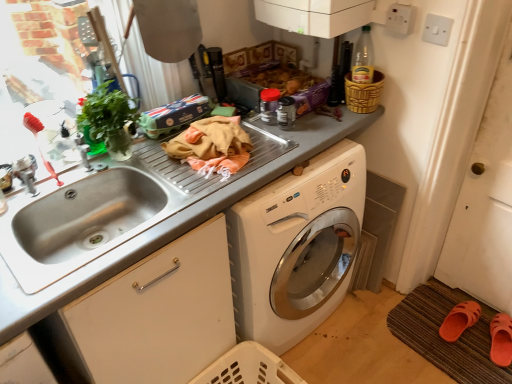
Locate an element on the screen. This screenshot has height=384, width=512. blank area beneath green leafy plant at left (from a real-world perspective) is located at coordinates (121, 161).